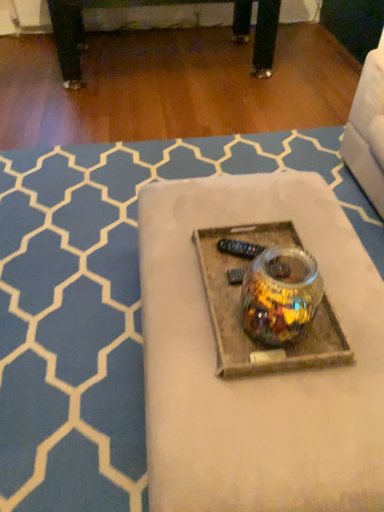
The height and width of the screenshot is (512, 384). I want to click on vacant space in front of translucent glass jar at center, so click(274, 362).